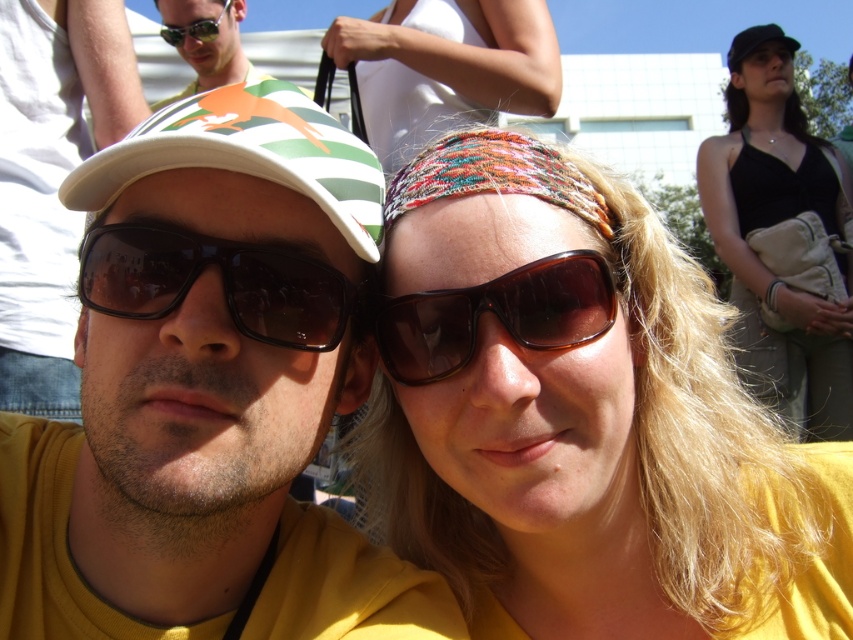
Question: Which of the following is the farthest from the observer?

Choices:
 (A) green and white striped baseball cap at left
 (B) matte white cap at center
 (C) multicolored woven headband at center

Answer: (C)

Question: Does black fabric tank top at upper right have a greater width compared to matte black sunglasses at center?

Choices:
 (A) yes
 (B) no

Answer: (A)

Question: Observing the image, what is the correct spatial positioning of woven fabric headband at upper center in reference to black plastic sunglasses at center?

Choices:
 (A) below
 (B) above

Answer: (B)

Question: Which object is the farthest from the camouflage-patterned hat at upper left?

Choices:
 (A) black fabric cap at upper right
 (B) brown textured sunglasses at center
 (C) black fabric tank top at upper right

Answer: (A)

Question: Among these objects, which one is nearest to the camera?

Choices:
 (A) matte black sunglasses at center
 (B) black fabric cap at upper right

Answer: (A)

Question: Is brown textured sunglasses at center below matte black sunglasses at center?

Choices:
 (A) yes
 (B) no

Answer: (A)